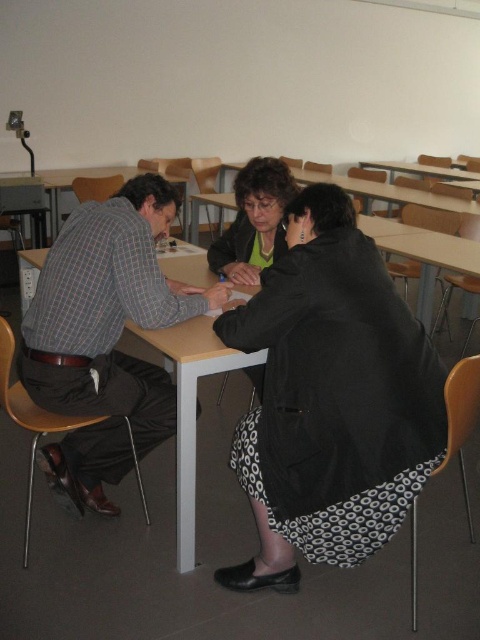
Is point (60, 326) positioned behind point (59, 184)?

That is False.

Does point (134, 394) come in front of point (84, 173)?

Yes, it is.

Identify the location of plaid fabric shirt at left. (106, 337).

Based on the photo, can you confirm if black textured skirt at lower center is bigger than wooden table at left?

No.

Between black textured skirt at lower center and wooden table at left, which one has less height?

wooden table at left is shorter.

Is point (376, 385) more distant than point (60, 179)?

That is False.

I want to click on black textured skirt at lower center, so click(x=331, y=400).

Between point (94, 396) and point (264, 216), which one is positioned behind?

Point (264, 216)

At what (x,y) coordinates should I click in order to perform the action: click on plaid fabric shirt at left. Please return your answer as a coordinate pair (x, y). Looking at the image, I should click on (106, 337).